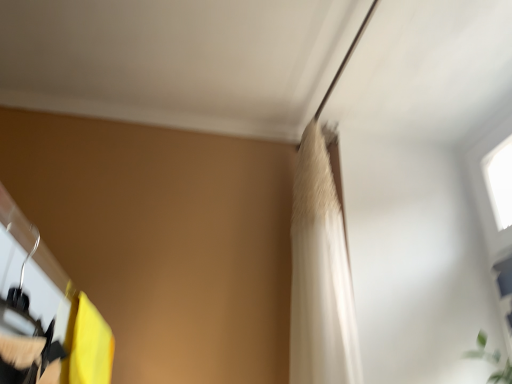
Question: Is there a large distance between white fabric shower curtain at upper center and yellow fabric curtain at lower left?

Choices:
 (A) no
 (B) yes

Answer: (A)

Question: From the image's perspective, is white fabric shower curtain at upper center on yellow fabric curtain at lower left?

Choices:
 (A) yes
 (B) no

Answer: (A)

Question: Is white fabric shower curtain at upper center facing away from yellow fabric curtain at lower left?

Choices:
 (A) no
 (B) yes

Answer: (A)

Question: Is white fabric shower curtain at upper center not within yellow fabric curtain at lower left?

Choices:
 (A) yes
 (B) no

Answer: (A)

Question: Does white fabric shower curtain at upper center appear on the left side of yellow fabric curtain at lower left?

Choices:
 (A) no
 (B) yes

Answer: (A)

Question: Can you confirm if white fabric shower curtain at upper center is bigger than yellow fabric curtain at lower left?

Choices:
 (A) no
 (B) yes

Answer: (B)

Question: Is yellow fabric curtain at lower left positioned behind white fabric shower curtain at upper center?

Choices:
 (A) no
 (B) yes

Answer: (A)

Question: Considering the relative sizes of yellow fabric curtain at lower left and white fabric shower curtain at upper center in the image provided, is yellow fabric curtain at lower left shorter than white fabric shower curtain at upper center?

Choices:
 (A) no
 (B) yes

Answer: (B)

Question: Is yellow fabric curtain at lower left far away from white fabric shower curtain at upper center?

Choices:
 (A) yes
 (B) no

Answer: (B)

Question: Is yellow fabric curtain at lower left wider than white fabric shower curtain at upper center?

Choices:
 (A) no
 (B) yes

Answer: (B)

Question: Can you confirm if yellow fabric curtain at lower left is thinner than white fabric shower curtain at upper center?

Choices:
 (A) yes
 (B) no

Answer: (B)

Question: Is yellow fabric curtain at lower left bigger than white fabric shower curtain at upper center?

Choices:
 (A) no
 (B) yes

Answer: (A)

Question: From a real-world perspective, is matte black hanger at left physically above yellow fabric curtain at lower left?

Choices:
 (A) no
 (B) yes

Answer: (A)